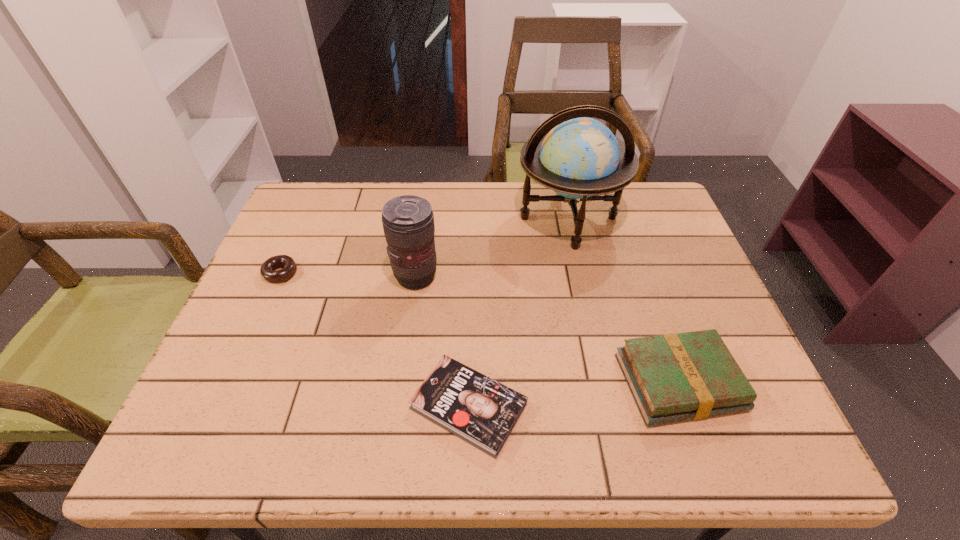
Where is `vacant area in the image that satisfies the following two spatial constraints: 1. on the side of the third shortest object where the control switches are located; 2. on the right side of the fourth shortest object`? Image resolution: width=960 pixels, height=540 pixels. vacant area in the image that satisfies the following two spatial constraints: 1. on the side of the third shortest object where the control switches are located; 2. on the right side of the fourth shortest object is located at coordinates (401, 382).

Find the location of a particular element. The height and width of the screenshot is (540, 960). vacant space that satisfies the following two spatial constraints: 1. on the surface of the tallest object; 2. on the right side of the third tallest object is located at coordinates (605, 382).

You are a GUI agent. You are given a task and a screenshot of the screen. Output one action in this format:
    pyautogui.click(x=<x>, y=<y>)
    Task: Click on the free space that satisfies the following two spatial constraints: 1. on the side of the telephoto lens where the control switches are located; 2. on the right side of the shorter book
    
    Given the screenshot: What is the action you would take?
    pyautogui.click(x=398, y=407)